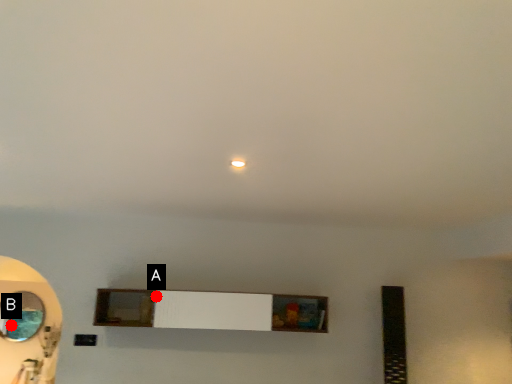
Question: Two points are circled on the image, labeled by A and B beside each circle. Which point is closer to the camera?

Choices:
 (A) A is closer
 (B) B is closer

Answer: (B)